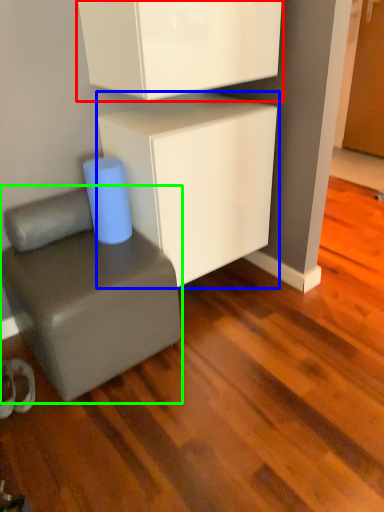
Question: Estimate the real-world distances between objects in this image. Which object is closer to cabinetry (highlighted by a red box), cabinetry (highlighted by a blue box) or furniture (highlighted by a green box)?

Choices:
 (A) cabinetry
 (B) furniture

Answer: (A)